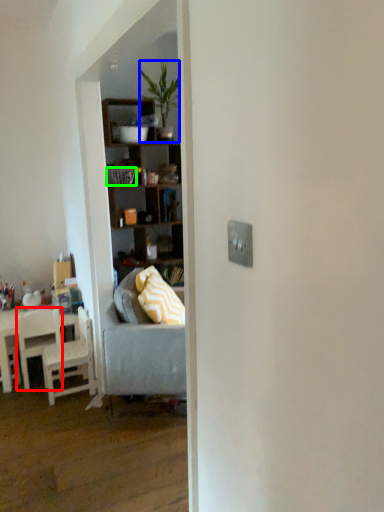
Question: Which object is the closest to the chair (highlighted by a red box)? Choose among these: houseplant (highlighted by a blue box) or picnic basket (highlighted by a green box).

Choices:
 (A) houseplant
 (B) picnic basket

Answer: (B)